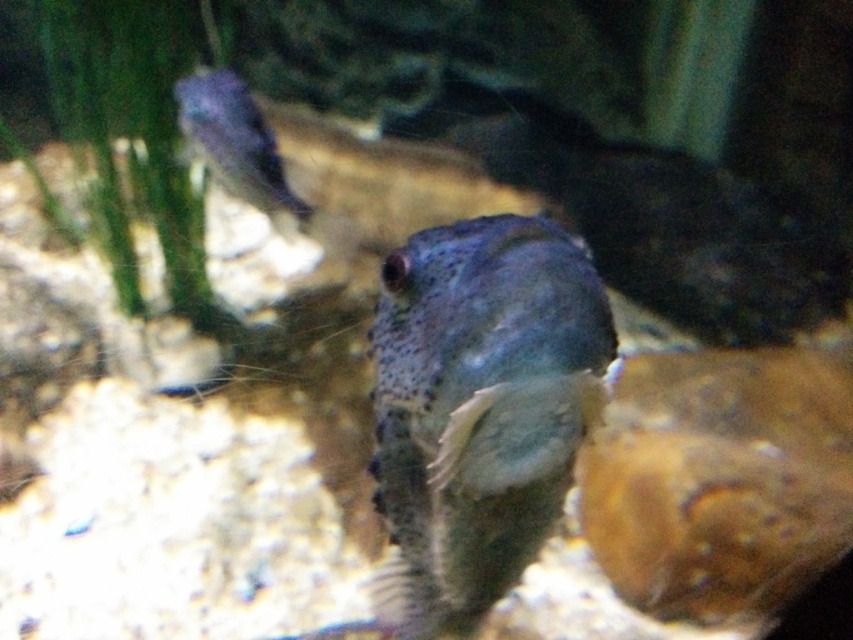
You are an underwater photographer trying to capture the speckled blue fish at center. The camera is positioned at point 0.5,0.5. In which direction should you move your camera to get the fish in the frame?

The speckled blue fish at center is located at point (479, 406). Since the camera is at (426, 320), you should move the camera slightly to the right and upward to center the fish in the frame.

You are an underwater photographer aiming to capture the speckled blue fish at center and the translucent blue fish at upper left. Which fish should you focus on first if you want to take a clear photo of both without adjusting your camera settings?

You should focus on the speckled blue fish at center first because it is closer to the viewer than the translucent blue fish at upper left. Since it is closer, focusing on it first will ensure that the camera is adjusted properly for the nearest subject, and the translucent blue fish at upper left may still be in focus if within the depth of field.

You are an underwater photographer aiming to capture both the speckled blue fish at center and the translucent blue fish at upper left in a single frame. Based on their positions, which fish should you focus on first to ensure both are in the shot?

The speckled blue fish at center is positioned on the right side of the translucent blue fish at upper left, so focusing on the translucent blue fish at upper left first would help frame both in the shot since it is closer to the left edge.